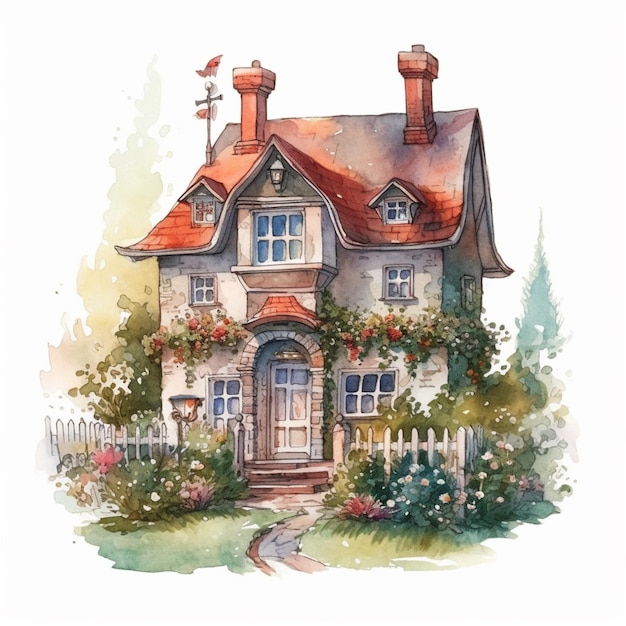
Find the location of a particular element. The image size is (626, 626). chimney is located at coordinates (418, 98).